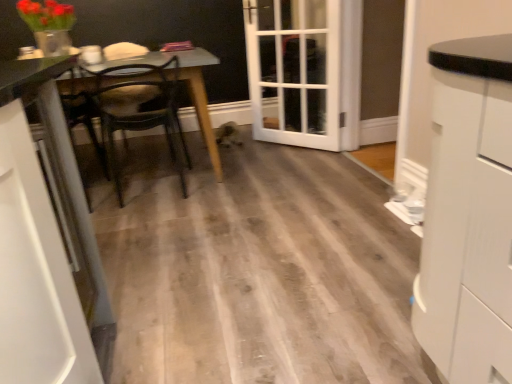
What do you see at coordinates (305, 71) in the screenshot? I see `white glass door at center` at bounding box center [305, 71].

Describe the element at coordinates (468, 214) in the screenshot. I see `white matte cabinet at right, arranged as the first cabinetry when viewed from the right` at that location.

At what (x,y) coordinates should I click in order to perform the action: click on wooden table at left. Please return your answer as a coordinate pair (x, y). The width and height of the screenshot is (512, 384). Looking at the image, I should click on (189, 90).

Measure the distance from wooden table at left to white matte cabinet at right, which is the second cabinetry from left to right.

A distance of 2.00 meters exists between wooden table at left and white matte cabinet at right, which is the second cabinetry from left to right.

Where is `the 2nd cabinetry to the right when counting from the wooden table at left`? the 2nd cabinetry to the right when counting from the wooden table at left is located at coordinates (468, 214).

Does wooden table at left appear on the right side of white matte cabinet at right, arranged as the first cabinetry when viewed from the right?

In fact, wooden table at left is to the left of white matte cabinet at right, arranged as the first cabinetry when viewed from the right.

Is wooden table at left shorter than white matte cabinet at right, which is the second cabinetry from left to right?

Indeed, wooden table at left has a lesser height compared to white matte cabinet at right, which is the second cabinetry from left to right.

Is wooden chair at center in front of white glass door at center?

That is True.

How different are the orientations of wooden chair at center and white glass door at center in degrees?

wooden chair at center and white glass door at center are facing 133 degrees away from each other.

Find the location of a particular element. door behind the wooden chair at center is located at coordinates pyautogui.click(x=305, y=71).

Based on the photo, is wooden chair at center taller or shorter than white glass door at center?

wooden chair at center is shorter than white glass door at center.

Can we say white glass door at center lies outside wooden table at left?

Yes, white glass door at center is outside of wooden table at left.

Can you confirm if white glass door at center is bigger than wooden table at left?

Incorrect, white glass door at center is not larger than wooden table at left.

From the image's perspective, who appears lower, white glass door at center or wooden table at left?

wooden table at left appears lower in the image.

From a real-world perspective, between white glass door at center and wooden table at left, who is vertically lower?

In real-world perspective, wooden table at left is lower.

Which of these two, wooden chair at center or wooden table at left, is thinner?

Thinner between the two is wooden chair at center.

Does wooden chair at center turn towards wooden table at left?

Yes, wooden chair at center is turned towards wooden table at left.

From their relative heights in the image, would you say wooden chair at center is taller or shorter than wooden table at left?

Clearly, wooden chair at center is taller compared to wooden table at left.

Is wooden table at left inside wooden chair at center?

No, wooden table at left is located outside of wooden chair at center.

Consider the image. From a real-world perspective, which object rests below the other?

In real-world perspective, wooden table at left is lower.

Is point (18, 84) less distant than point (140, 74)?

Yes.

Can you confirm if wooden table at left is positioned to the left of wooden chair at center?

Yes, wooden table at left is to the left of wooden chair at center.

Measure the distance from wooden table at left to wooden chair at center.

wooden table at left is 19.13 inches from wooden chair at center.

Considering the relative sizes of white glossy cabinet at left, which ranks as the second cabinetry in right-to-left order, and white matte cabinet at right, arranged as the first cabinetry when viewed from the right, in the image provided, is white glossy cabinet at left, which ranks as the second cabinetry in right-to-left order, thinner than white matte cabinet at right, arranged as the first cabinetry when viewed from the right,?

Yes.

Is white glossy cabinet at left, arranged as the 1th cabinetry when viewed from the left, facing away from white matte cabinet at right, which is the second cabinetry from left to right?

No, white glossy cabinet at left, arranged as the 1th cabinetry when viewed from the left,'s orientation is not away from white matte cabinet at right, which is the second cabinetry from left to right.

Which is behind, point (9, 277) or point (436, 328)?

The point (436, 328) is farther from the camera.

Relative to white glossy cabinet at left, arranged as the 1th cabinetry when viewed from the left, is wooden chair at center in front or behind?

wooden chair at center is positioned farther from the viewer than white glossy cabinet at left, arranged as the 1th cabinetry when viewed from the left.

Based on the photo, considering the sizes of objects wooden chair at center and white glossy cabinet at left, which ranks as the second cabinetry in right-to-left order, in the image provided, who is bigger, wooden chair at center or white glossy cabinet at left, which ranks as the second cabinetry in right-to-left order,?

Bigger between the two is wooden chair at center.

In the scene shown: Considering the relative positions of wooden chair at center and white glossy cabinet at left, which ranks as the second cabinetry in right-to-left order, in the image provided, is wooden chair at center to the right of white glossy cabinet at left, which ranks as the second cabinetry in right-to-left order, from the viewer's perspective?

Incorrect, wooden chair at center is not on the right side of white glossy cabinet at left, which ranks as the second cabinetry in right-to-left order.

This screenshot has width=512, height=384. Find the location of `cabinetry that is the 2nd one above the wooden table at left (from a real-world perspective)`. cabinetry that is the 2nd one above the wooden table at left (from a real-world perspective) is located at coordinates (468, 214).

Find the location of a particular element. Image resolution: width=512 pixels, height=384 pixels. chair in front of the white glass door at center is located at coordinates (139, 110).

Estimate the real-world distances between objects in this image. Which object is further from white glass door at center, white glossy cabinet at left, which ranks as the second cabinetry in right-to-left order, or wooden chair at center?

white glossy cabinet at left, which ranks as the second cabinetry in right-to-left order.

Considering their positions, is white matte cabinet at right, which is the second cabinetry from left to right, positioned further to white glossy cabinet at left, which ranks as the second cabinetry in right-to-left order, than wooden table at left?

wooden table at left.

Based on their spatial positions, is wooden table at left or white glass door at center further from white matte cabinet at right, which is the second cabinetry from left to right?

white glass door at center is positioned further to the anchor white matte cabinet at right, which is the second cabinetry from left to right.

When comparing their distances from white glass door at center, does white matte cabinet at right, which is the second cabinetry from left to right, or white glossy cabinet at left, arranged as the 1th cabinetry when viewed from the left, seem further?

Among the two, white glossy cabinet at left, arranged as the 1th cabinetry when viewed from the left, is located further to white glass door at center.

Based on their spatial positions, is white matte cabinet at right, arranged as the first cabinetry when viewed from the right, or wooden table at left closer to wooden chair at center?

Based on the image, wooden table at left appears to be nearer to wooden chair at center.

From the picture: When comparing their distances from white glossy cabinet at left, which ranks as the second cabinetry in right-to-left order, does wooden table at left or white glass door at center seem further?

white glass door at center is further to white glossy cabinet at left, which ranks as the second cabinetry in right-to-left order.

When comparing their distances from white glossy cabinet at left, which ranks as the second cabinetry in right-to-left order, does white matte cabinet at right, which is the second cabinetry from left to right, or wooden chair at center seem closer?

white matte cabinet at right, which is the second cabinetry from left to right, is positioned closer to the anchor white glossy cabinet at left, which ranks as the second cabinetry in right-to-left order.

From the image, which object appears to be farther from wooden chair at center, wooden table at left or white matte cabinet at right, which is the second cabinetry from left to right?

white matte cabinet at right, which is the second cabinetry from left to right, is further to wooden chair at center.

Identify the location of chair positioned between white matte cabinet at right, which is the second cabinetry from left to right, and wooden table at left from near to far. This screenshot has height=384, width=512. (139, 110).

Image resolution: width=512 pixels, height=384 pixels. I want to click on cabinetry located between white matte cabinet at right, arranged as the first cabinetry when viewed from the right, and white glass door at center in the depth direction, so click(x=37, y=244).

Locate an element on the screen. chair between white matte cabinet at right, which is the second cabinetry from left to right, and white glass door at center, along the z-axis is located at coordinates (139, 110).

The image size is (512, 384). Find the location of `chair positioned between white glossy cabinet at left, which ranks as the second cabinetry in right-to-left order, and white glass door at center from near to far`. chair positioned between white glossy cabinet at left, which ranks as the second cabinetry in right-to-left order, and white glass door at center from near to far is located at coordinates (139, 110).